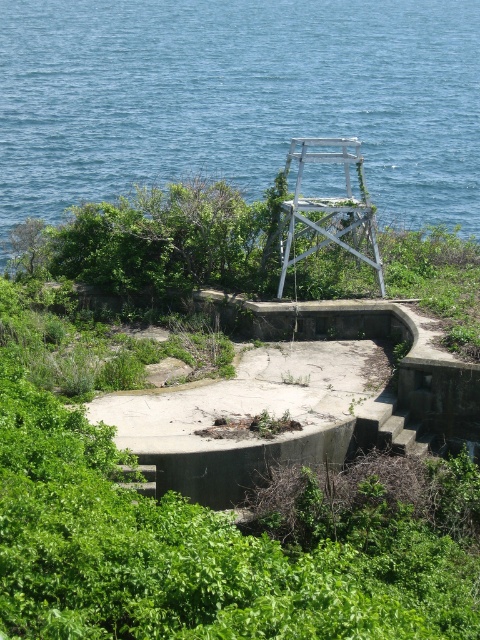
You are standing at the base of the abandoned watchtower on the grassy hillside. You notice a point marked at coordinates (238,99). Based on the scene, where is this point located?

The point at (238,99) is on the blue water at upper center of the image.

You are a hiker standing at the base of the hillside looking towards the abandoned tower. You see the blue water at upper center and the green leafy vegetation at center. Which object is closer to you?

The green leafy vegetation at center is behind the blue water at upper center, so the blue water at upper center is closer to you.

From the picture: You are a drone operator trying to capture a photo of the blue water at upper center and the green leafy vegetation at center from above. Based on the scene, which object would require you to adjust your drone to a wider angle to fully capture in the frame?

The blue water at upper center might be wider than green leafy vegetation at center, so you would need to adjust the drone to a wider angle to fully capture the blue water at upper center in the frame.